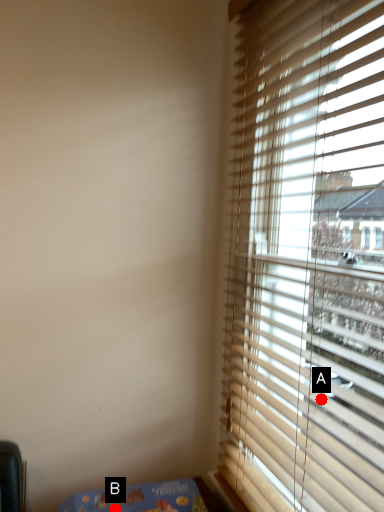
Question: Two points are circled on the image, labeled by A and B beside each circle. Which point is closer to the camera?

Choices:
 (A) A is closer
 (B) B is closer

Answer: (A)